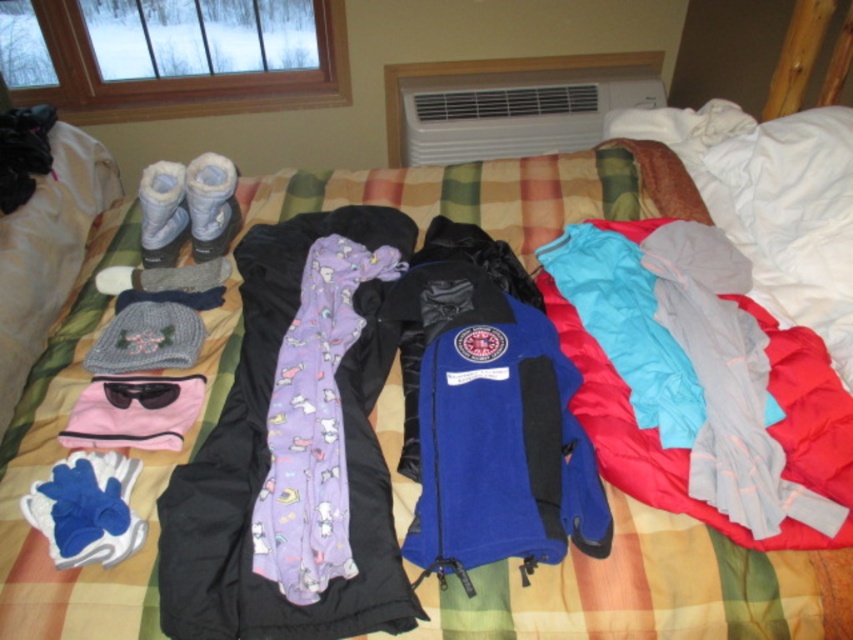
Question: Does purple fleece scarf at center have a greater width compared to blue fleece jacket at center?

Choices:
 (A) no
 (B) yes

Answer: (B)

Question: Which of these objects is positioned farthest from the light blue fabric at center?

Choices:
 (A) purple fleece scarf at center
 (B) blue fleece jacket at center

Answer: (A)

Question: Does purple fleece scarf at center have a lesser width compared to blue fleece jacket at center?

Choices:
 (A) no
 (B) yes

Answer: (A)

Question: Which object is the farthest from the light blue fabric at center?

Choices:
 (A) blue fleece jacket at center
 (B) purple fleece scarf at center

Answer: (B)

Question: In this image, where is purple fleece scarf at center located relative to light blue fabric at center?

Choices:
 (A) right
 (B) left

Answer: (B)

Question: Which point is farther to the camera?

Choices:
 (A) blue fleece jacket at center
 (B) light blue fabric at center
 (C) purple fleece scarf at center

Answer: (B)